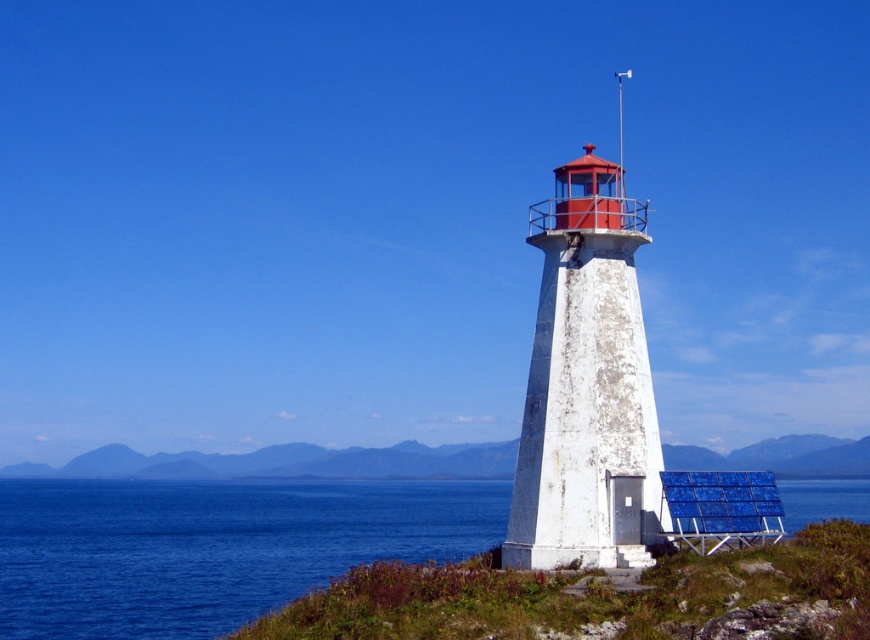
Is blue water at lower left behind green grass at lower right?

No, blue water at lower left is in front of green grass at lower right.

Is point (201, 630) more distant than point (731, 456)?

No, (201, 630) is closer to viewer.

Identify the location of blue water at lower left. (211, 547).

Identify the location of blue water at lower left. pos(211,547).

Is blue water at lower left to the right of white weathered lighthouse at center from the viewer's perspective?

Incorrect, blue water at lower left is not on the right side of white weathered lighthouse at center.

What do you see at coordinates (211, 547) in the screenshot?
I see `blue water at lower left` at bounding box center [211, 547].

Locate an element on the screen. blue water at lower left is located at coordinates (211, 547).

Who is more distant from viewer, (559, 397) or (231, 454)?

The point (231, 454) is more distant.

At what (x,y) coordinates should I click in order to perform the action: click on white weathered lighthouse at center. Please return your answer as a coordinate pair (x, y). Looking at the image, I should click on (587, 385).

At what (x,y) coordinates should I click in order to perform the action: click on white weathered lighthouse at center. Please return your answer as a coordinate pair (x, y). Looking at the image, I should click on (587, 385).